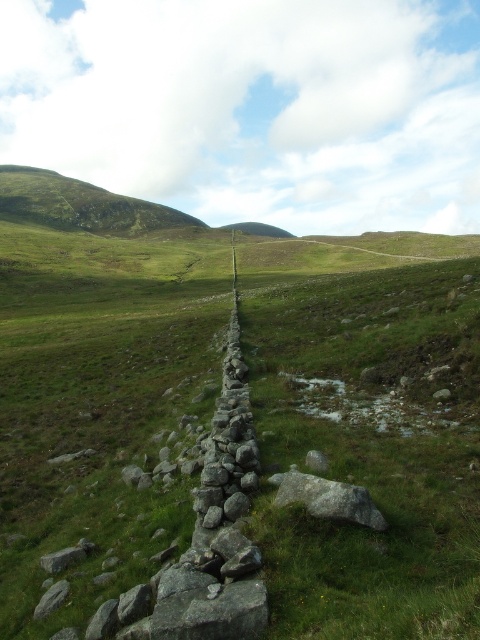
You are a hiker who wants to place a small flag on the highest point between the gray rough rock at center and the gray rough stone at lower left. Which object should you choose?

The gray rough rock at center has a greater height compared to the gray rough stone at lower left, so you should place the flag on the gray rough rock at center.

You are a hiker standing at the base of the prominent hill in the scene. You see the gray rough rock at center and the gray rough stone at lower left. Which object is located higher up the hill?

The gray rough rock at center is positioned over the gray rough stone at lower left, meaning it is higher up the hill.